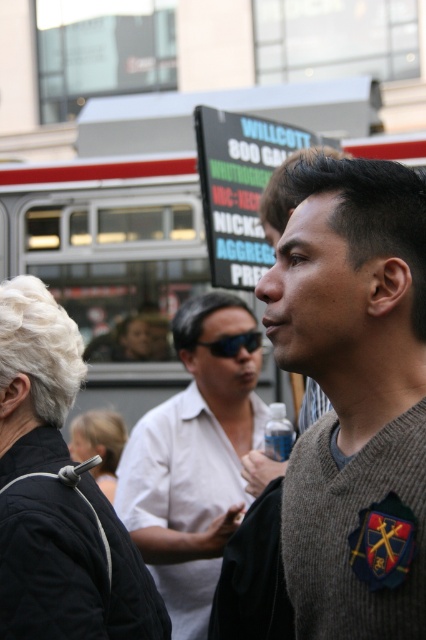
Which is below, gray wool sweater at center or black plastic sunglasses at center?

gray wool sweater at center is lower down.

Is point (351, 532) farther from viewer compared to point (221, 353)?

No, (351, 532) is closer to viewer.

Is point (313, 621) closer to viewer compared to point (252, 340)?

Yes.

In order to click on gray wool sweater at center in this screenshot , I will do click(354, 397).

Can you confirm if gray wool sweater at center is thinner than white shirt at center?

Indeed, gray wool sweater at center has a lesser width compared to white shirt at center.

Is gray wool sweater at center further to the viewer compared to white shirt at center?

No, it is in front of white shirt at center.

Between point (405, 172) and point (160, 420), which one is positioned behind?

The point (160, 420) is behind.

Identify the location of gray wool sweater at center. This screenshot has width=426, height=640. (354, 397).

Can you confirm if black fabric at upper left is thinner than blonde hair at center?

In fact, black fabric at upper left might be wider than blonde hair at center.

From the picture: Who is positioned more to the left, black fabric at upper left or blonde hair at center?

blonde hair at center

Is point (0, 298) behind point (115, 465)?

No, it is in front of (115, 465).

Identify the location of black fabric at upper left. (57, 493).